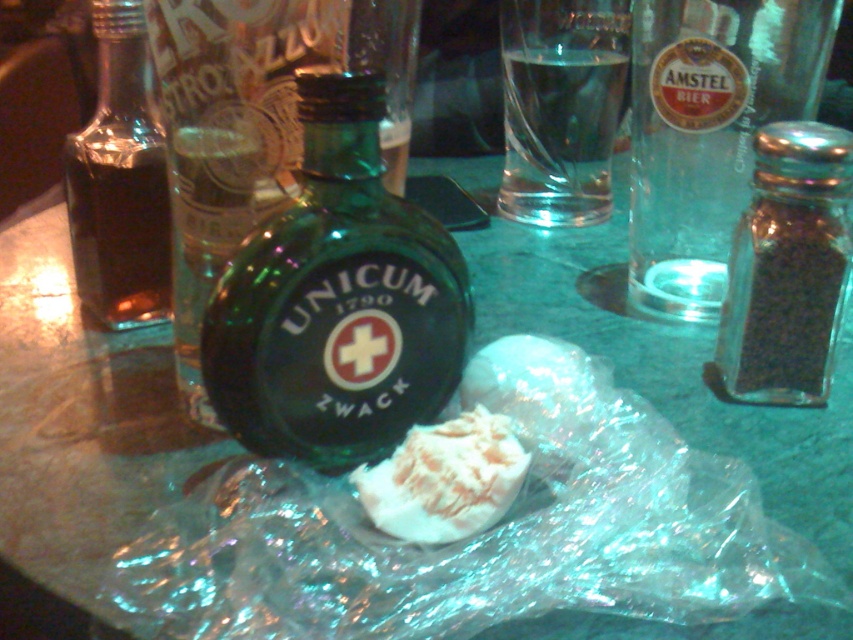
Is green glass bottle at center smaller than dark brown glass bottle at left?

Indeed, green glass bottle at center has a smaller size compared to dark brown glass bottle at left.

Is point (370, 360) positioned behind point (112, 268)?

No, it is not.

Locate an element on the screen. The image size is (853, 640). green glass bottle at center is located at coordinates (337, 301).

Image resolution: width=853 pixels, height=640 pixels. I want to click on green glass bottle at center, so click(337, 301).

Does green glass bottle at center have a greater width compared to clear glass bottle at right?

In fact, green glass bottle at center might be narrower than clear glass bottle at right.

Locate an element on the screen. green glass bottle at center is located at coordinates (337, 301).

Which of these two, transparent glass pepper shaker at center-right or white crumbly cheese at center, stands shorter?

With less height is white crumbly cheese at center.

Who is lower down, transparent glass pepper shaker at center-right or white crumbly cheese at center?

white crumbly cheese at center is below.

Describe the element at coordinates (787, 268) in the screenshot. The width and height of the screenshot is (853, 640). I see `transparent glass pepper shaker at center-right` at that location.

Find the location of a particular element. transparent glass pepper shaker at center-right is located at coordinates (787, 268).